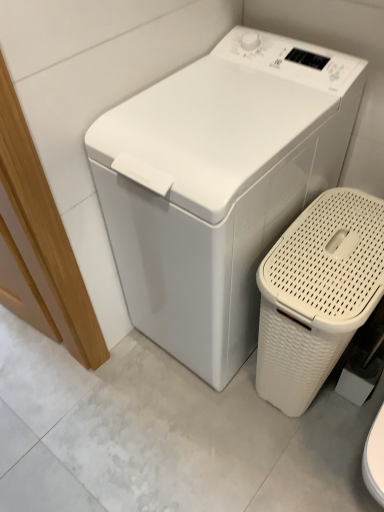
Find the location of `white woven basket at lower right`. white woven basket at lower right is located at coordinates (317, 294).

What do you see at coordinates (317, 294) in the screenshot? I see `white woven basket at lower right` at bounding box center [317, 294].

Find the location of a particular element. Image resolution: width=384 pixels, height=512 pixels. white plastic washing machine at center is located at coordinates (218, 185).

What do you see at coordinates (218, 185) in the screenshot?
I see `white plastic washing machine at center` at bounding box center [218, 185].

Identify the location of white woven basket at lower right. The image size is (384, 512). (317, 294).

Which is more to the right, white plastic washing machine at center or white woven basket at lower right?

white woven basket at lower right.

Is white plastic washing machine at center further to the viewer compared to white woven basket at lower right?

No, it is not.

Which is further, (x=226, y=259) or (x=337, y=331)?

The point (x=226, y=259) is farther from the camera.

From the image's perspective, which is below, white plastic washing machine at center or white woven basket at lower right?

white woven basket at lower right is shown below in the image.

From a real-world perspective, who is located lower, white plastic washing machine at center or white woven basket at lower right?

From a 3D spatial view, white woven basket at lower right is below.

Considering the sizes of objects white plastic washing machine at center and white woven basket at lower right in the image provided, who is wider, white plastic washing machine at center or white woven basket at lower right?

white plastic washing machine at center.

Considering the sizes of objects white plastic washing machine at center and white woven basket at lower right in the image provided, who is taller, white plastic washing machine at center or white woven basket at lower right?

With more height is white plastic washing machine at center.

Which of these two, white plastic washing machine at center or white woven basket at lower right, is smaller?

Smaller between the two is white woven basket at lower right.

Can we say white plastic washing machine at center lies outside white woven basket at lower right?

Yes, white plastic washing machine at center is outside of white woven basket at lower right.

Can you see white plastic washing machine at center touching white woven basket at lower right?

They are not placed beside each other.

Is white plastic washing machine at center oriented towards white woven basket at lower right?

No.

How different are the orientations of white plastic washing machine at center and white woven basket at lower right in degrees?

The angle between the facing direction of white plastic washing machine at center and the facing direction of white woven basket at lower right is 0.101 degrees.

Identify the location of garbage on the right of white plastic washing machine at center. This screenshot has height=512, width=384. (317, 294).

Between white woven basket at lower right and white plastic washing machine at center, which one appears on the right side from the viewer's perspective?

From the viewer's perspective, white woven basket at lower right appears more on the right side.

Does white woven basket at lower right lie in front of white plastic washing machine at center?

No, white woven basket at lower right is further to the viewer.

Which point is more distant from viewer, (x=285, y=375) or (x=135, y=248)?

The point (x=285, y=375) is farther from the camera.

From the image's perspective, would you say white woven basket at lower right is positioned over white plastic washing machine at center?

No, from the image's perspective, white woven basket at lower right is not above white plastic washing machine at center.

From a real-world perspective, which object stands above the other?

white plastic washing machine at center.

Does white woven basket at lower right have a greater width compared to white plastic washing machine at center?

No.

From their relative heights in the image, would you say white woven basket at lower right is taller or shorter than white plastic washing machine at center?

In the image, white woven basket at lower right appears to be shorter than white plastic washing machine at center.

Considering the relative sizes of white woven basket at lower right and white plastic washing machine at center in the image provided, is white woven basket at lower right smaller than white plastic washing machine at center?

Yes.

Does white woven basket at lower right contain white plastic washing machine at center?

No, white plastic washing machine at center is not a part of white woven basket at lower right.

Is white woven basket at lower right beside white plastic washing machine at center?

white woven basket at lower right and white plastic washing machine at center are clearly separated.

Is white woven basket at lower right facing away from white plastic washing machine at center?

No, white plastic washing machine at center is not at the back of white woven basket at lower right.

In the scene shown: How different are the orientations of white woven basket at lower right and white plastic washing machine at center in degrees?

0.101 degrees separate the facing orientations of white woven basket at lower right and white plastic washing machine at center.

Measure the distance between white woven basket at lower right and white plastic washing machine at center.

white woven basket at lower right and white plastic washing machine at center are 8.81 inches apart from each other.

The width and height of the screenshot is (384, 512). Find the location of `washing machine above the white woven basket at lower right (from the image's perspective)`. washing machine above the white woven basket at lower right (from the image's perspective) is located at coordinates (218, 185).

In order to click on washing machine in front of the white woven basket at lower right in this screenshot , I will do `click(218, 185)`.

Locate an element on the screen. This screenshot has height=512, width=384. garbage on the right of white plastic washing machine at center is located at coordinates (317, 294).